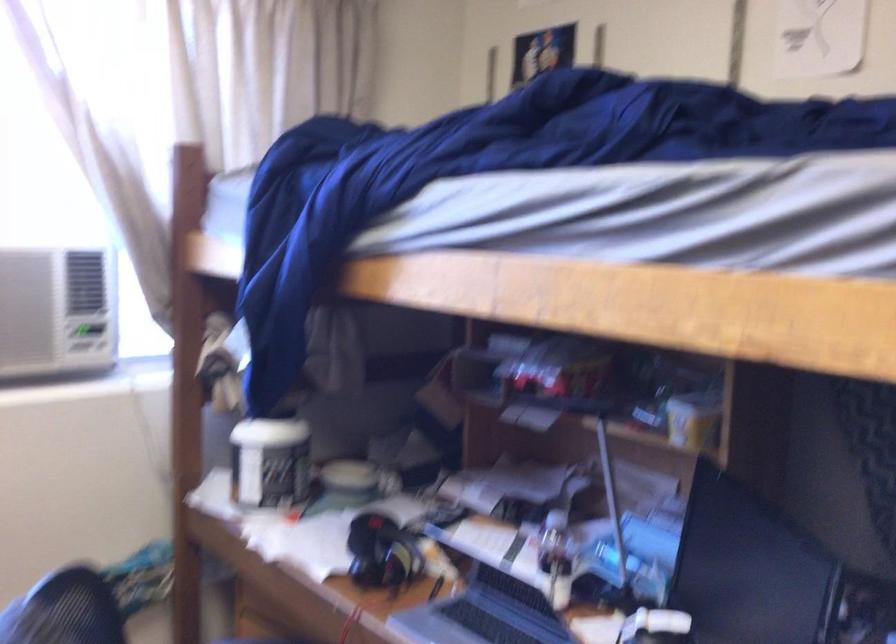
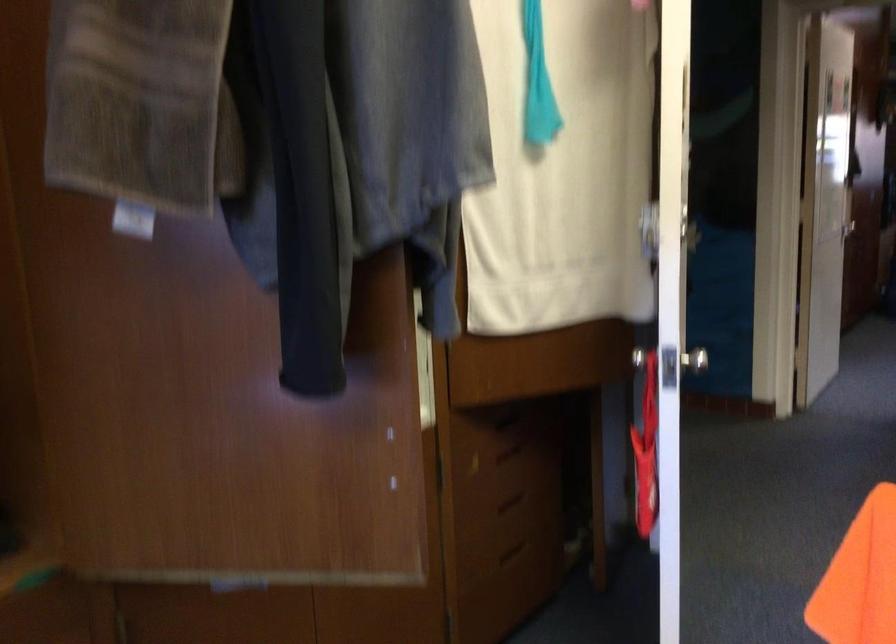
Question: The camera is either moving clockwise (left) or counter-clockwise (right) around the object. The first image is from the beginning of the video and the second image is from the end. Is the camera moving left or right when shooting the video?

Choices:
 (A) Left
 (B) Right

Answer: (A)